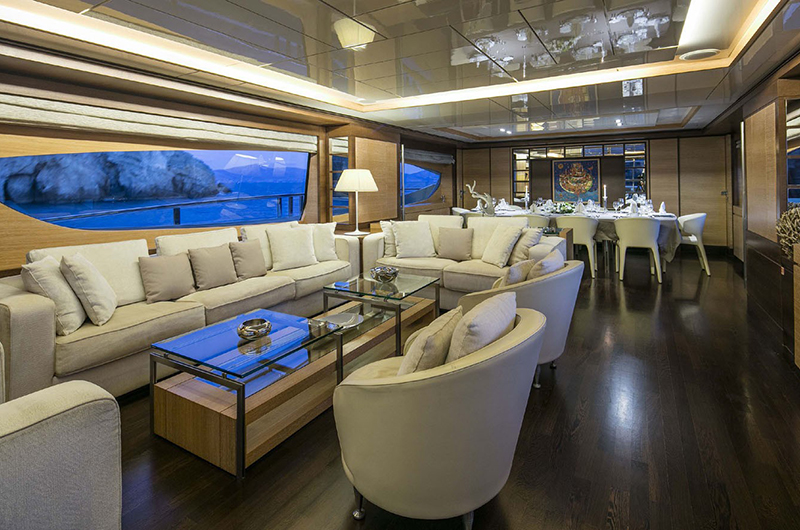
This screenshot has width=800, height=530. In order to click on glass table in this screenshot , I will do `click(241, 372)`.